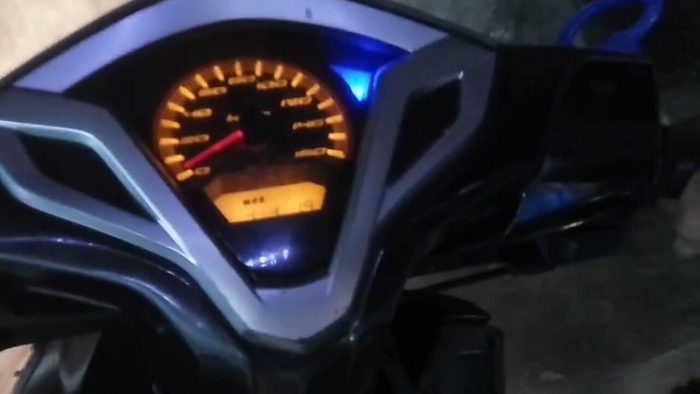
You are a GUI agent. You are given a task and a screenshot of the screen. Output one action in this format:
    pyautogui.click(x=<x>, y=<y>)
    Task: Click on the right handle
    
    Given the screenshot: What is the action you would take?
    pyautogui.click(x=631, y=211)